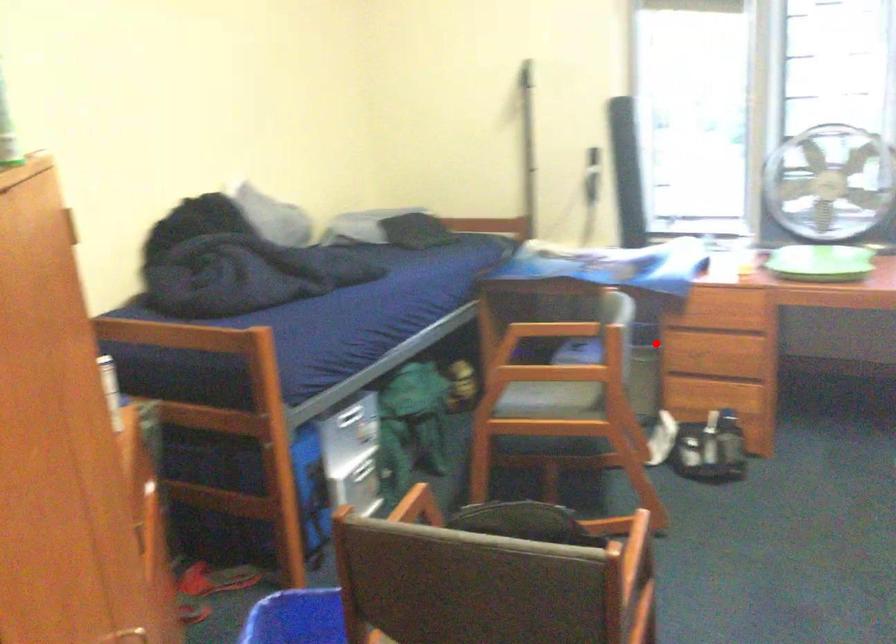
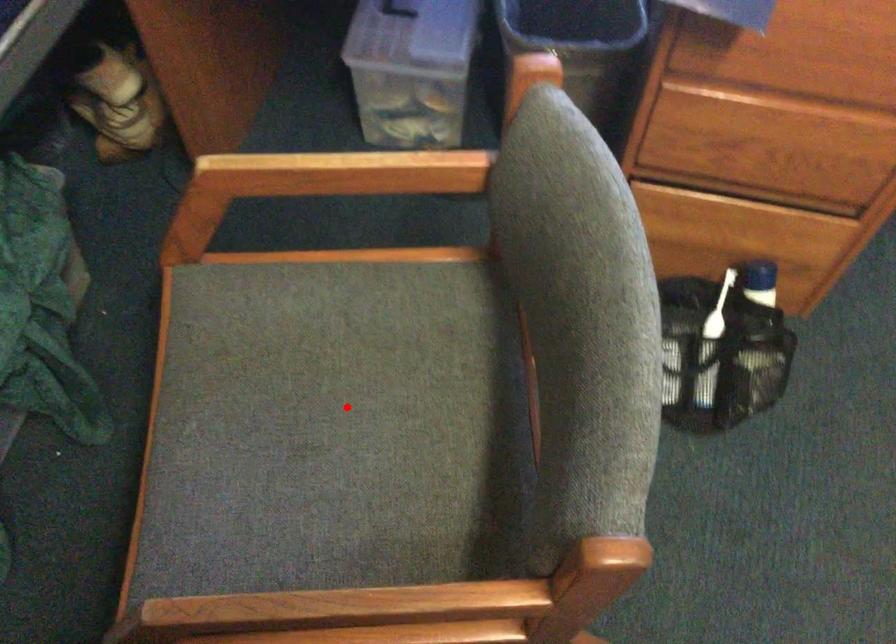
I am providing you with two images of the same scene from different viewpoints. A red point is marked on the first image and another point is marked on the second image. Do the highlighted points in image1 and image2 indicate the same real-world spot?

No